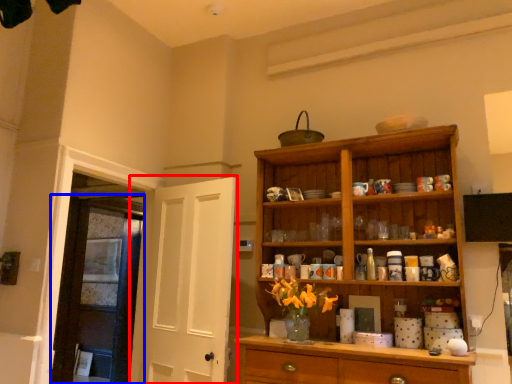
Question: Among these objects, which one is nearest to the camera, door (highlighted by a red box) or door (highlighted by a blue box)?

Choices:
 (A) door
 (B) door

Answer: (A)